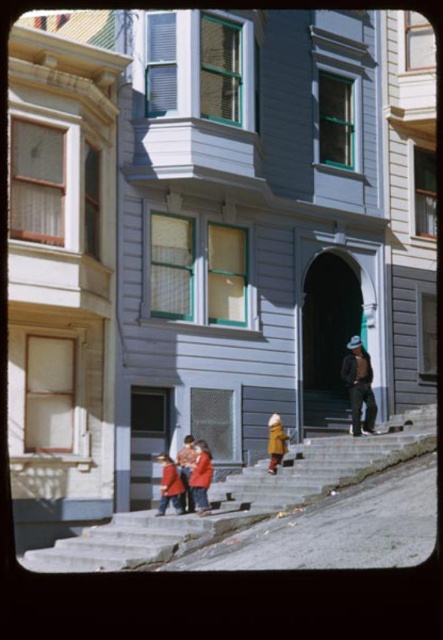
You are standing at the base of the steep hill in front of the house. There are two points marked on the image. One is at coordinate point (194,502) and the other is at point (268,424). If you were to walk towards the house, which point would you encounter first?

Point (194,502) is in front of point (268,424), so you would encounter point (194,502) first as you walk towards the house.

You are a delivery person trying to deliver a package to the house. You see the concrete stairs at center and the red wool coat at center. Which object takes up more space in the image?

The concrete stairs at center is larger in size than the red wool coat at center, so the concrete stairs at center takes up more space in the image.